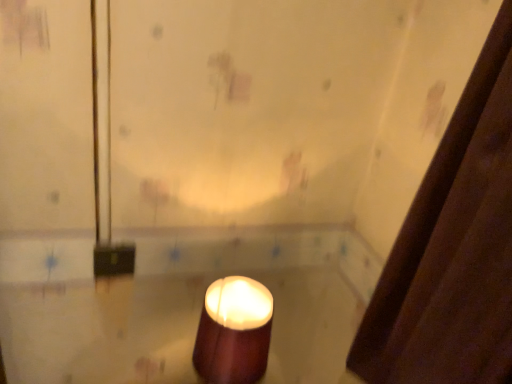
Question: Considering the relative sizes of matte brown candle at center and brown fabric shower curtain at right in the image provided, is matte brown candle at center shorter than brown fabric shower curtain at right?

Choices:
 (A) no
 (B) yes

Answer: (B)

Question: Are matte brown candle at center and brown fabric shower curtain at right far apart?

Choices:
 (A) yes
 (B) no

Answer: (B)

Question: Does matte brown candle at center turn towards brown fabric shower curtain at right?

Choices:
 (A) no
 (B) yes

Answer: (A)

Question: From the image's perspective, is matte brown candle at center located above brown fabric shower curtain at right?

Choices:
 (A) yes
 (B) no

Answer: (B)

Question: From a real-world perspective, is matte brown candle at center physically above brown fabric shower curtain at right?

Choices:
 (A) no
 (B) yes

Answer: (A)

Question: Can you confirm if matte brown candle at center is bigger than brown fabric shower curtain at right?

Choices:
 (A) no
 (B) yes

Answer: (A)

Question: Is brown fabric shower curtain at right further to the viewer compared to matte brown candle at center?

Choices:
 (A) yes
 (B) no

Answer: (B)

Question: Considering the relative sizes of brown fabric shower curtain at right and matte brown candle at center in the image provided, is brown fabric shower curtain at right bigger than matte brown candle at center?

Choices:
 (A) no
 (B) yes

Answer: (B)

Question: From a real-world perspective, does brown fabric shower curtain at right sit lower than matte brown candle at center?

Choices:
 (A) yes
 (B) no

Answer: (B)

Question: Is brown fabric shower curtain at right next to matte brown candle at center?

Choices:
 (A) yes
 (B) no

Answer: (B)

Question: Is brown fabric shower curtain at right not inside matte brown candle at center?

Choices:
 (A) yes
 (B) no

Answer: (A)

Question: From a real-world perspective, is brown fabric shower curtain at right positioned over matte brown candle at center based on gravity?

Choices:
 (A) no
 (B) yes

Answer: (B)

Question: From their relative heights in the image, would you say matte brown candle at center is taller or shorter than brown fabric shower curtain at right?

Choices:
 (A) tall
 (B) short

Answer: (B)